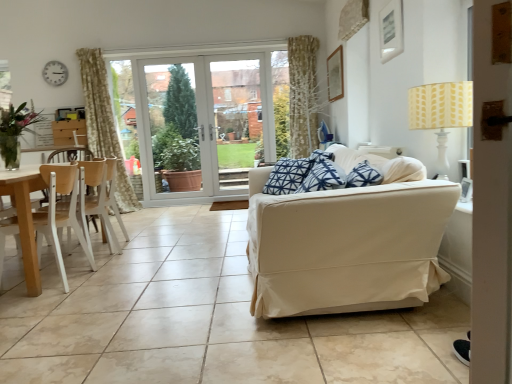
Question: From the image's perspective, is white plastic clock at upper left located above or below beige ceramic tile at center?

Choices:
 (A) above
 (B) below

Answer: (A)

Question: Considering the positions of white plastic clock at upper left and beige ceramic tile at center in the image, is white plastic clock at upper left taller or shorter than beige ceramic tile at center?

Choices:
 (A) tall
 (B) short

Answer: (A)

Question: Which object is the closest to the yellow printed fabric lampshade at upper right?

Choices:
 (A) white plastic clock at upper left
 (B) wooden chair at left, acting as the 1th chair starting from the back
 (C) beige fabric couch at right
 (D) light wood/wooden chair at left, which appears as the second chair when viewed from the back
 (E) clear glass vase at left

Answer: (C)

Question: Which object is the closest to the wooden chair at left, the 2th chair from the front?

Choices:
 (A) white plastic clock at upper left
 (B) white glass door at center
 (C) light wood/wooden chair at left, positioned as the 1th chair in front-to-back order
 (D) beige fabric couch at right
 (E) blue printed fabric pillow at center

Answer: (C)